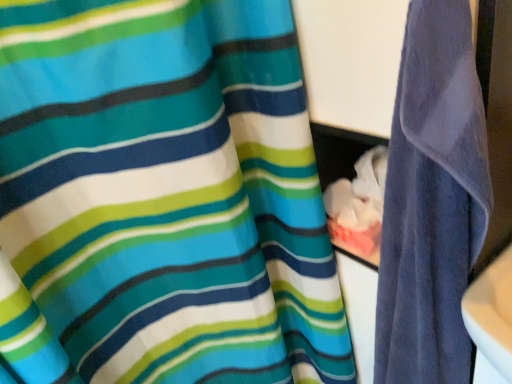
Question: Should I look upward or downward to see purple velvety towel at right?

Choices:
 (A) down
 (B) up

Answer: (A)